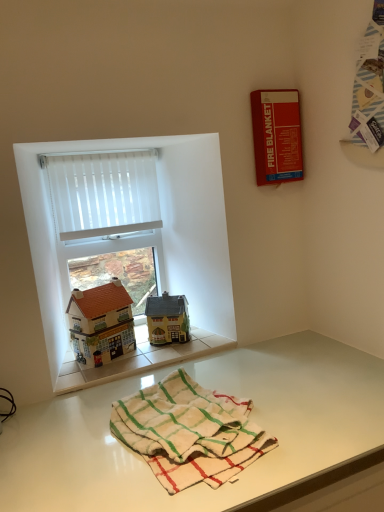
At what (x,y) coordinates should I click in order to perform the action: click on vacant space to the right of matte brown house at left, the second toy viewed from the right. Please return your answer as a coordinate pair (x, y). Looking at the image, I should click on pyautogui.click(x=148, y=355).